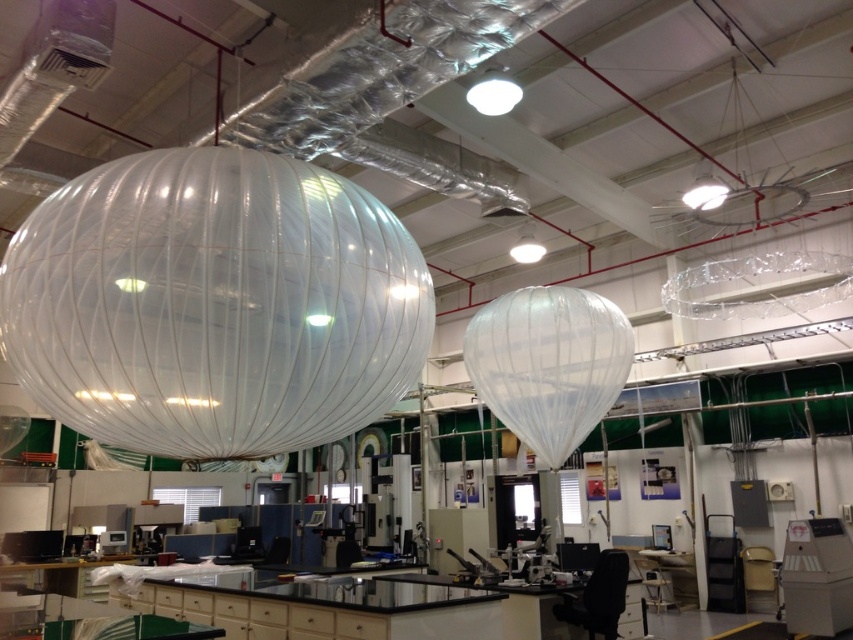
Between transparent ribbed balloon at center and transparent plastic balloon at center, which one appears on the right side from the viewer's perspective?

Positioned to the right is transparent ribbed balloon at center.

Is point (543, 435) positioned before point (13, 428)?

Yes.

Locate an element on the screen. Image resolution: width=853 pixels, height=640 pixels. transparent ribbed balloon at center is located at coordinates (548, 364).

Who is more distant from viewer, [305,353] or [569,330]?

Point [569,330]

Does transparent plastic balloon at upper left have a larger size compared to transparent ribbed balloon at center?

Actually, transparent plastic balloon at upper left might be smaller than transparent ribbed balloon at center.

Image resolution: width=853 pixels, height=640 pixels. I want to click on transparent plastic balloon at upper left, so click(x=213, y=305).

This screenshot has height=640, width=853. In order to click on transparent plastic balloon at upper left in this screenshot , I will do `click(213, 305)`.

Does transparent plastic balloon at upper left have a greater width compared to transparent plastic balloon at center?

Yes, transparent plastic balloon at upper left is wider than transparent plastic balloon at center.

Is transparent plastic balloon at upper left shorter than transparent plastic balloon at center?

No.

Locate an element on the screen. The width and height of the screenshot is (853, 640). transparent plastic balloon at upper left is located at coordinates (213, 305).

Identify the location of transparent plastic balloon at upper left. The image size is (853, 640). (213, 305).